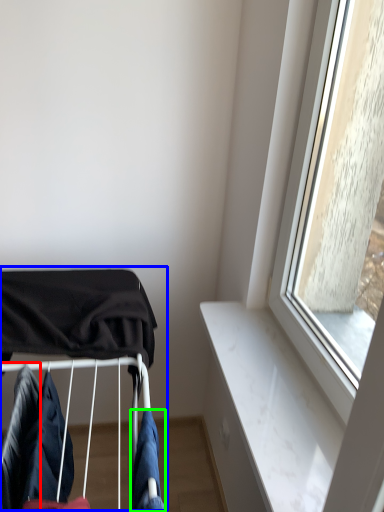
Question: Estimate the real-world distances between objects in this image. Which object is closer to clothing (highlighted by a red box), baby carriage (highlighted by a blue box) or clothing (highlighted by a green box)?

Choices:
 (A) baby carriage
 (B) clothing

Answer: (A)